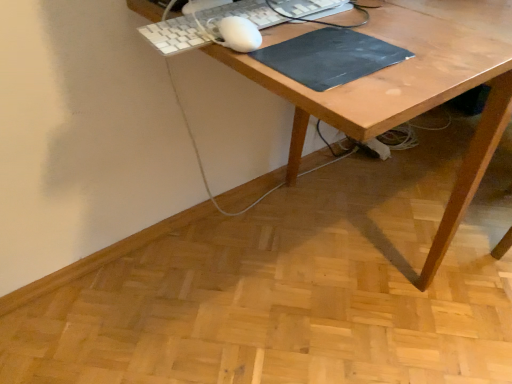
Question: Does wooden desk at center have a lesser width compared to white plastic keyboard at upper center?

Choices:
 (A) no
 (B) yes

Answer: (A)

Question: Is wooden desk at center behind white plastic keyboard at upper center?

Choices:
 (A) yes
 (B) no

Answer: (B)

Question: From the image's perspective, would you say wooden desk at center is positioned over white plastic keyboard at upper center?

Choices:
 (A) no
 (B) yes

Answer: (B)

Question: From the image's perspective, is wooden desk at center beneath white plastic keyboard at upper center?

Choices:
 (A) yes
 (B) no

Answer: (B)

Question: From a real-world perspective, is wooden desk at center over white plastic keyboard at upper center?

Choices:
 (A) no
 (B) yes

Answer: (A)

Question: From the image's perspective, is white plastic keyboard at upper center above or below wooden desk at center?

Choices:
 (A) above
 (B) below

Answer: (B)

Question: Based on their positions, is white plastic keyboard at upper center located to the left or right of wooden desk at center?

Choices:
 (A) left
 (B) right

Answer: (A)

Question: Considering the positions of point tap(288, 3) and point tap(423, 23), is point tap(288, 3) closer or farther from the camera than point tap(423, 23)?

Choices:
 (A) closer
 (B) farther

Answer: (B)

Question: Is white plastic keyboard at upper center wider or thinner than wooden desk at center?

Choices:
 (A) wide
 (B) thin

Answer: (B)

Question: From the image's perspective, relative to white plastic keyboard at upper center, is black matte mousepad at center above or below?

Choices:
 (A) above
 (B) below

Answer: (B)

Question: Based on their positions, is black matte mousepad at center located to the left or right of white plastic keyboard at upper center?

Choices:
 (A) right
 (B) left

Answer: (A)

Question: From their relative heights in the image, would you say black matte mousepad at center is taller or shorter than white plastic keyboard at upper center?

Choices:
 (A) tall
 (B) short

Answer: (B)

Question: Is black matte mousepad at center wider or thinner than white plastic keyboard at upper center?

Choices:
 (A) thin
 (B) wide

Answer: (B)

Question: In terms of height, does wooden desk at center look taller or shorter compared to white plastic keyboard at upper center?

Choices:
 (A) short
 (B) tall

Answer: (B)

Question: From the image's perspective, relative to white plastic keyboard at upper center, is wooden desk at center above or below?

Choices:
 (A) above
 (B) below

Answer: (A)